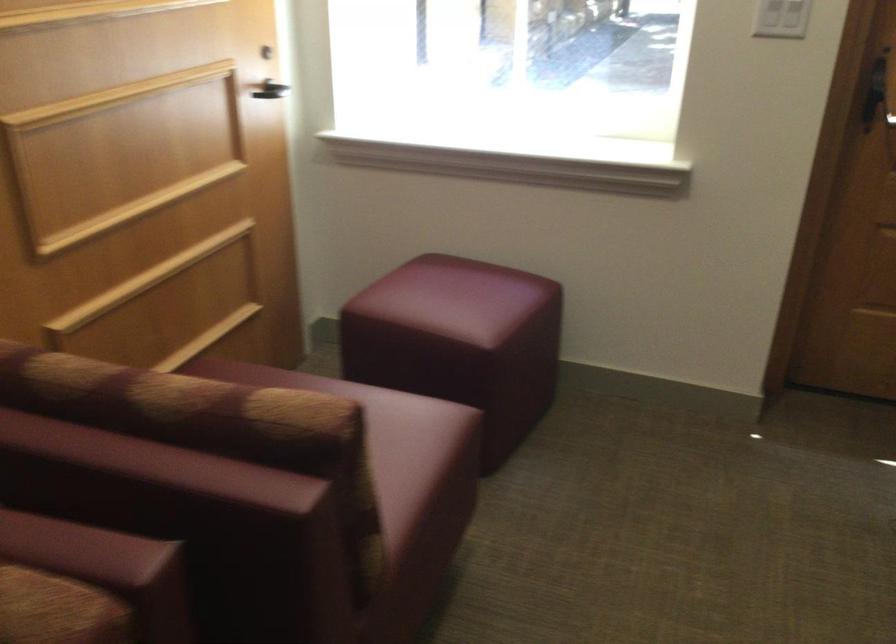
Describe the element at coordinates (780, 19) in the screenshot. I see `a white light switch` at that location.